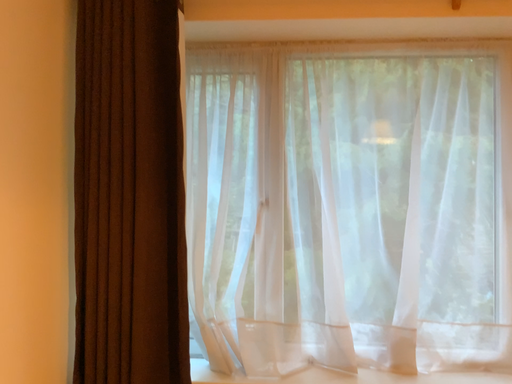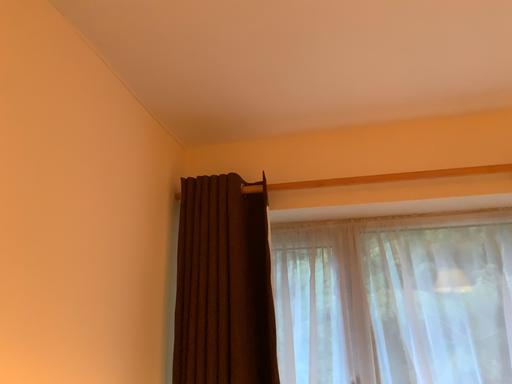
Question: Which way did the camera rotate in the video?

Choices:
 (A) rotated downward
 (B) rotated upward

Answer: (B)